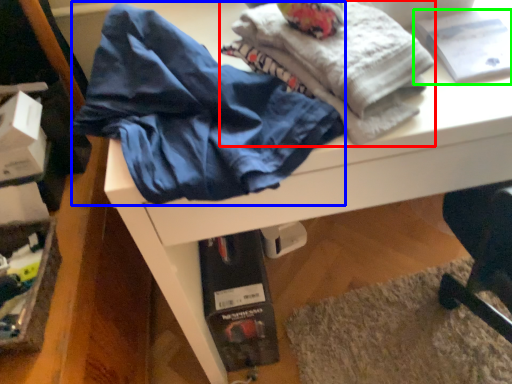
Question: Considering the real-world distances, which object is closest to fabric (highlighted by a red box)? clothing (highlighted by a blue box) or book (highlighted by a green box).

Choices:
 (A) clothing
 (B) book

Answer: (A)